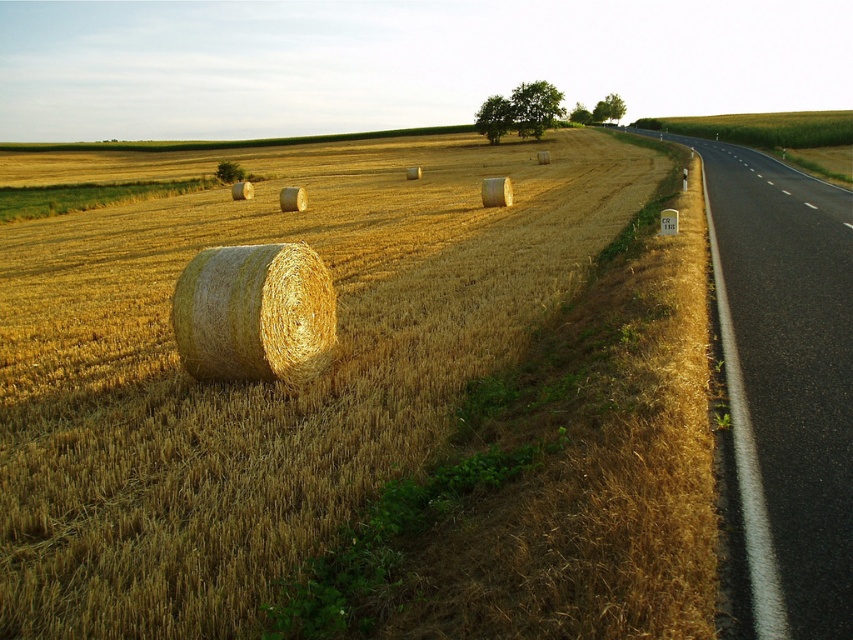
Question: Is asphalt road at right closer to camera compared to golden straw bale at center?

Choices:
 (A) yes
 (B) no

Answer: (A)

Question: Considering the real-world distances, which object is closest to the asphalt road at right?

Choices:
 (A) golden straw bale at center
 (B) golden straw bale at center-left

Answer: (A)

Question: Which is farther from the golden straw bale at center?

Choices:
 (A) asphalt road at right
 (B) golden straw bale at center-left

Answer: (B)

Question: Considering the relative positions of golden straw bale at center-left and asphalt road at right in the image provided, where is golden straw bale at center-left located with respect to asphalt road at right?

Choices:
 (A) left
 (B) right

Answer: (A)

Question: In this image, where is asphalt road at right located relative to golden straw bale at center?

Choices:
 (A) right
 (B) left

Answer: (A)

Question: Which of the following is the closest to the observer?

Choices:
 (A) asphalt road at right
 (B) golden straw bale at center
 (C) golden straw bale at center-left

Answer: (A)